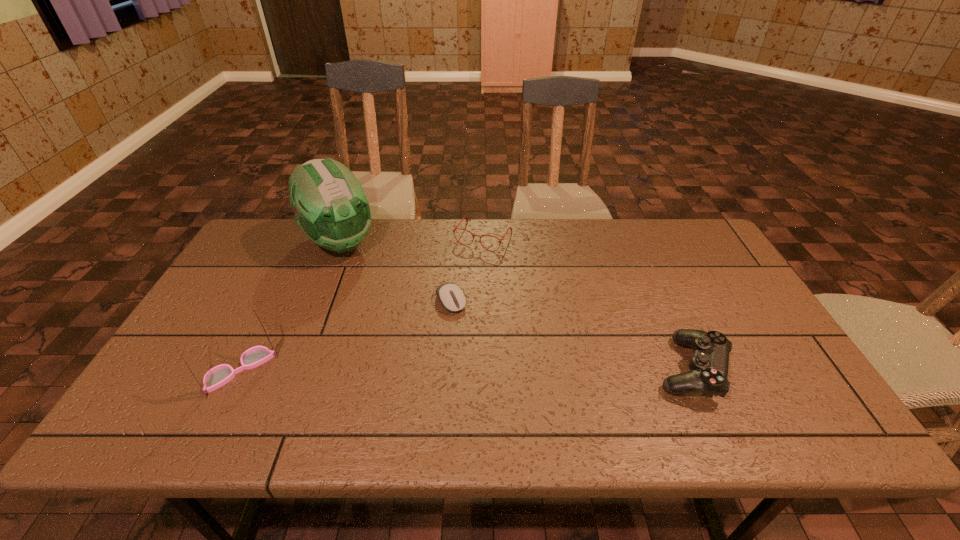
At what (x,y) coordinates should I click in order to perform the action: click on free region at the left edge of the desktop. Please return your answer as a coordinate pair (x, y). Image resolution: width=960 pixels, height=540 pixels. Looking at the image, I should click on (234, 280).

Identify the location of free space at the far left corner of the desktop. This screenshot has width=960, height=540. (279, 242).

Find the location of a particular element. The image size is (960, 540). vacant space at the far right corner is located at coordinates (670, 219).

Image resolution: width=960 pixels, height=540 pixels. In order to click on vacant space that is in between the farther spectacles and the third farthest object in this screenshot , I will do `click(468, 269)`.

Identify the location of vacant region between the computer equipment and the shorter spectacles. Image resolution: width=960 pixels, height=540 pixels. (468, 269).

Locate an element on the screen. blank region between the control and the shortest object is located at coordinates (571, 335).

Identify the location of vacant area that lies between the nearer spectacles and the right spectacles. (362, 303).

At what (x,y) coordinates should I click in order to perform the action: click on empty location between the control and the tallest object. Please return your answer as a coordinate pair (x, y). Image resolution: width=960 pixels, height=540 pixels. Looking at the image, I should click on click(516, 306).

You are a GUI agent. You are given a task and a screenshot of the screen. Output one action in this format:
    pyautogui.click(x=<x>, y=<y>)
    Task: Click on the empty location between the left spectacles and the second shortest object
    
    Given the screenshot: What is the action you would take?
    pyautogui.click(x=362, y=303)

Locate an element on the screen. The width and height of the screenshot is (960, 540). free area in between the shortest object and the control is located at coordinates (571, 335).